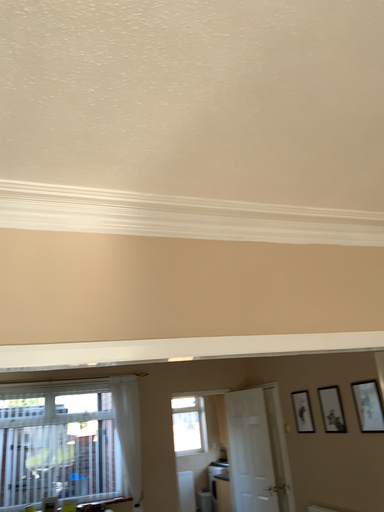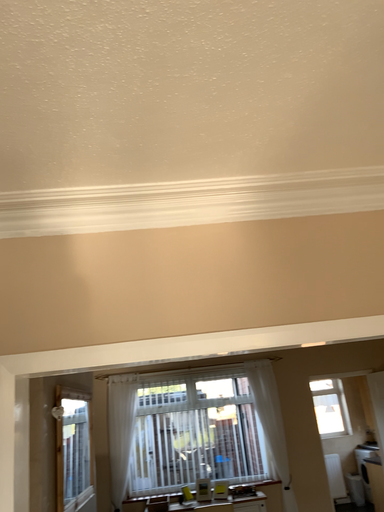
Question: How did the camera likely rotate when shooting the video?

Choices:
 (A) rotated left
 (B) rotated right

Answer: (A)